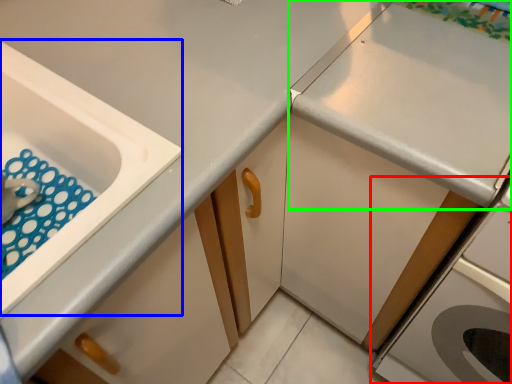
Question: Which object is the farthest from home appliance (highlighted by a red box)? Choose among these: sink (highlighted by a blue box) or countertop (highlighted by a green box).

Choices:
 (A) sink
 (B) countertop

Answer: (A)